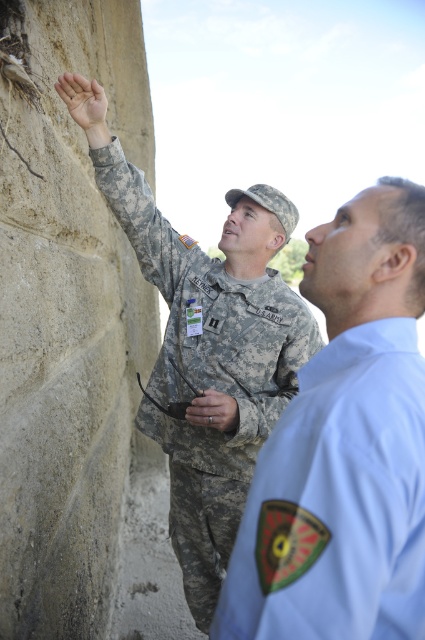
Question: Observing the image, what is the correct spatial positioning of light blue uniform at upper right in reference to camouflage fabric uniform at upper left?

Choices:
 (A) below
 (B) above

Answer: (B)

Question: Does light blue uniform at upper right appear under camouflage fabric uniform at upper left?

Choices:
 (A) yes
 (B) no

Answer: (B)

Question: Which of the following is the farthest from the observer?

Choices:
 (A) light blue uniform at upper right
 (B) camouflage fabric uniform at upper left

Answer: (B)

Question: Which of the following is the closest to the observer?

Choices:
 (A) light blue uniform at upper right
 (B) camouflage fabric uniform at upper left

Answer: (A)

Question: Is light blue uniform at upper right bigger than camouflage fabric uniform at upper left?

Choices:
 (A) no
 (B) yes

Answer: (A)